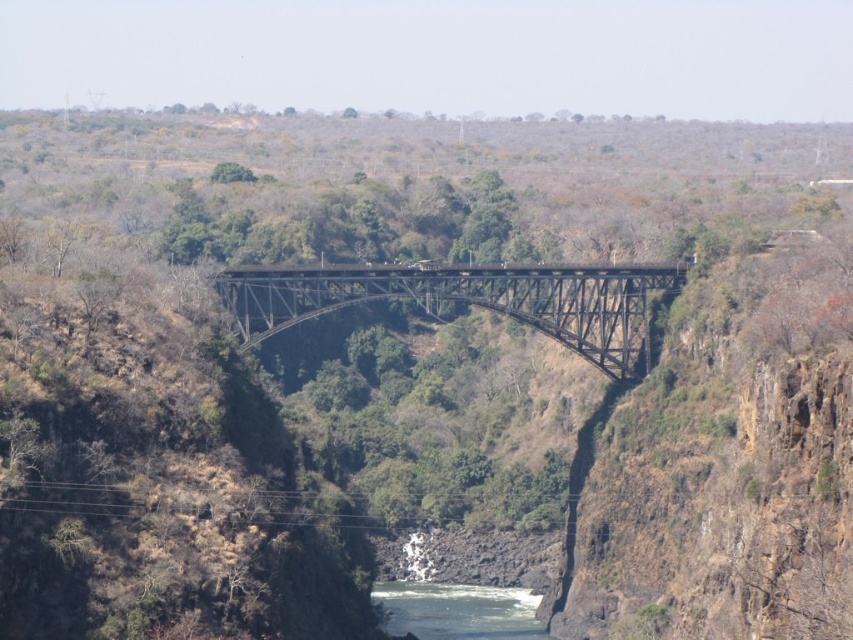
Does point (497, 278) lie in front of point (537, 621)?

No, it is behind (537, 621).

In order to click on black metal bridge at center in this screenshot , I will do `click(469, 301)`.